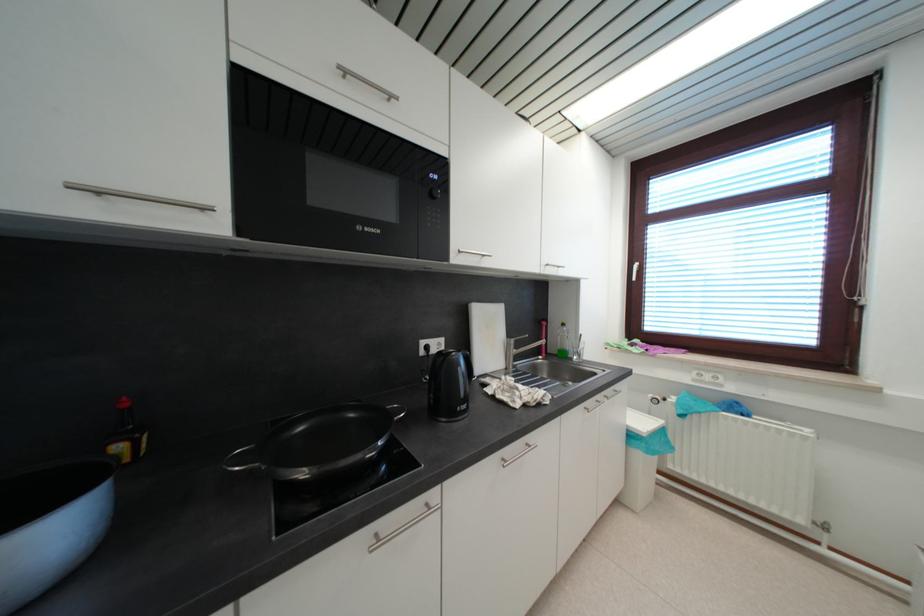
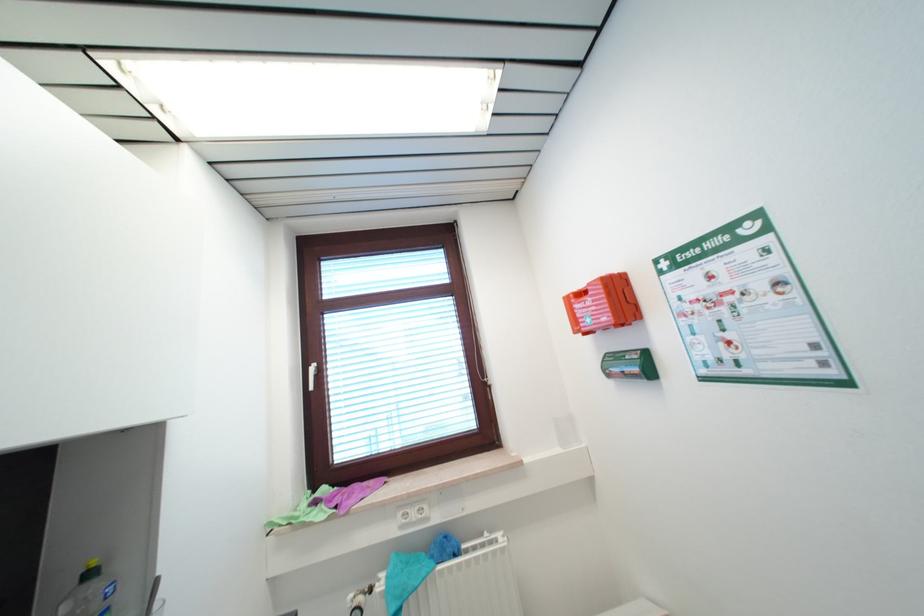
The point at (677, 402) is marked in the first image. Where is the corresponding point in the second image?

(385, 589)